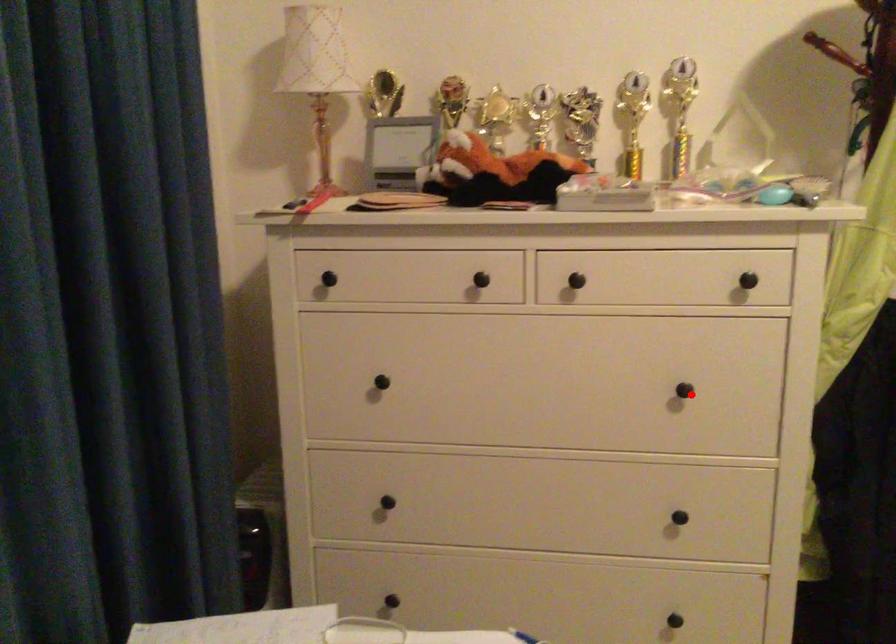
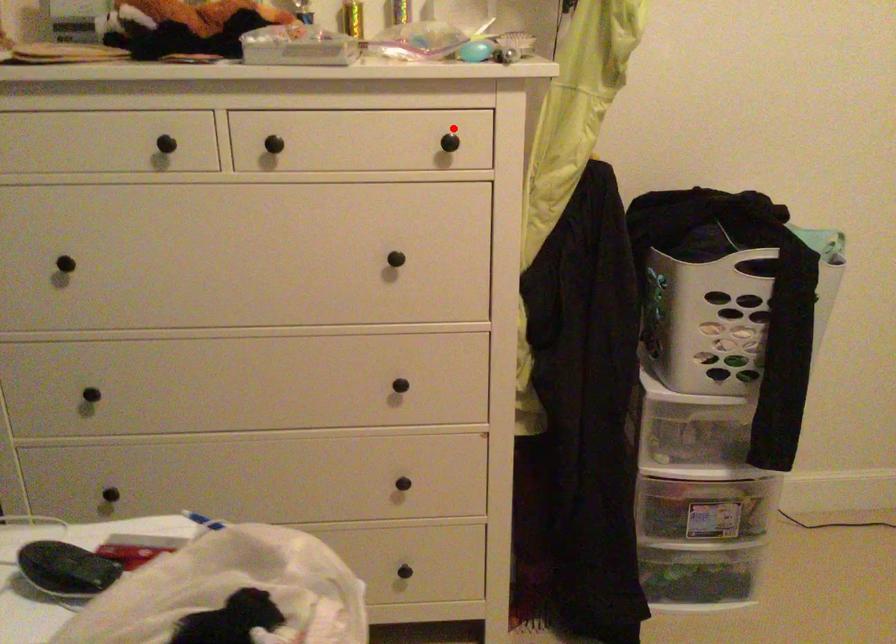
I am providing you with two images of the same scene from different viewpoints. A red point is marked on the first image and another point is marked on the second image. Do the highlighted points in image1 and image2 indicate the same real-world spot?

No